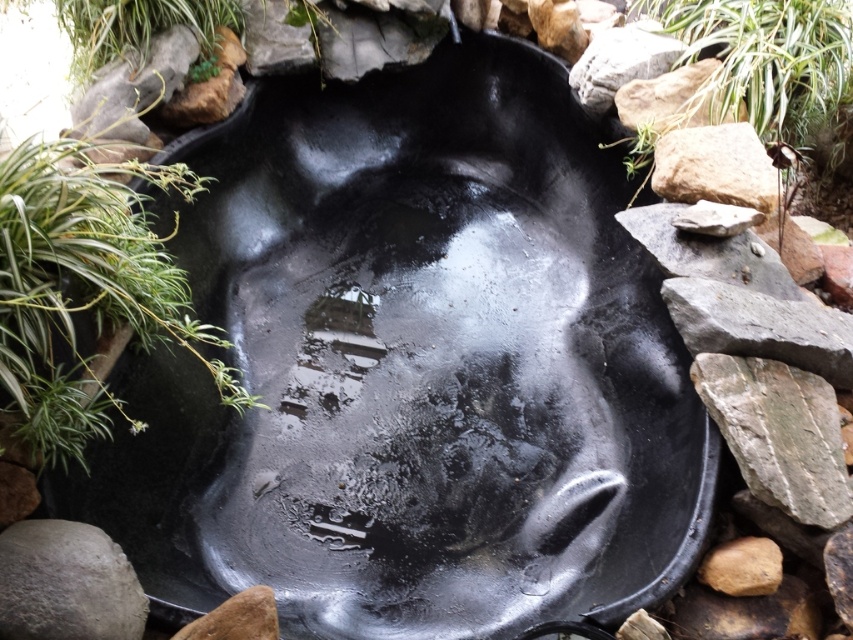
You are a gardener who wants to trim the green leafy plant at upper right and the gray rough stone at right. Since you have a limited amount of time, which object should you prioritize trimming first based on their sizes?

The green leafy plant at upper right is much taller than the gray rough stone at right, so you should prioritize trimming the green leafy plant at upper right first as it requires more attention due to its height.

You are standing in front of the black basin in the garden. You notice two points marked on the basin. The first point is at coordinate [22,536] and the second is at [734,170]. Which point is closer to your current position?

Point [22,536] is closer to the viewer than point [734,170].

You are a gardener who wants to place a new decorative item in the basin. You have a small statue that needs to be placed in front of the gray rough stone at right. Where should you position it relative to the green leafy plant at upper right?

The gray rough stone at right is behind the green leafy plant at upper right, so to place the statue in front of the gray rough stone at right, you should position it behind the green leafy plant at upper right.